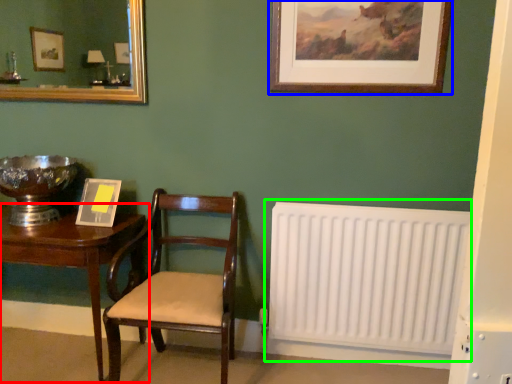
Question: Based on their relative distances, which object is nearer to table (highlighted by a red box)? Choose from picture frame (highlighted by a blue box) and radiator (highlighted by a green box).

Choices:
 (A) picture frame
 (B) radiator

Answer: (B)